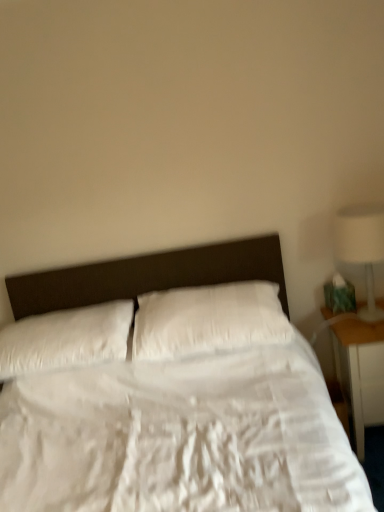
Where is `white soft pillow at left, which appears as the 1th pillow when viewed from the left`? white soft pillow at left, which appears as the 1th pillow when viewed from the left is located at coordinates (66, 339).

Measure the distance between white soft pillow at left, placed as the 2th pillow when sorted from right to left, and camera.

The distance of white soft pillow at left, placed as the 2th pillow when sorted from right to left, from camera is 5.82 feet.

Describe the element at coordinates (208, 320) in the screenshot. I see `white soft pillow at center, marked as the first pillow in a right-to-left arrangement` at that location.

Locate an element on the screen. wooden nightstand at right is located at coordinates (360, 373).

Can you confirm if wooden nightstand at right is shorter than white glossy lamp at right?

No.

Considering the sizes of objects wooden nightstand at right and white glossy lamp at right in the image provided, who is bigger, wooden nightstand at right or white glossy lamp at right?

wooden nightstand at right.

Does point (374, 381) appear closer or farther from the camera than point (382, 233)?

Point (374, 381) is farther from the camera than point (382, 233).

From the image's perspective, is wooden nightstand at right beneath white glossy lamp at right?

Indeed, from the image's perspective, wooden nightstand at right is shown beneath white glossy lamp at right.

From the image's perspective, which object appears higher, white glossy lamp at right or wooden nightstand at right?

white glossy lamp at right appears higher in the image.

Between white glossy lamp at right and wooden nightstand at right, which one has less height?

white glossy lamp at right.

Considering the relative positions of white glossy lamp at right and wooden nightstand at right in the image provided, is white glossy lamp at right to the left or to the right of wooden nightstand at right?

Clearly, white glossy lamp at right is on the left of wooden nightstand at right in the image.

Are white glossy lamp at right and white soft pillow at center, arranged as the second pillow when viewed from the left, located far from each other?

No.

Which object is thinner, white glossy lamp at right or white soft pillow at center, marked as the first pillow in a right-to-left arrangement?

white glossy lamp at right.

Who is bigger, white glossy lamp at right or white soft pillow at center, marked as the first pillow in a right-to-left arrangement?

With larger size is white soft pillow at center, marked as the first pillow in a right-to-left arrangement.

Is white soft pillow at left, which appears as the 1th pillow when viewed from the left, directly adjacent to wooden nightstand at right?

They are not placed beside each other.

From the image's perspective, which object appears higher, white soft pillow at left, which appears as the 1th pillow when viewed from the left, or wooden nightstand at right?

white soft pillow at left, which appears as the 1th pillow when viewed from the left, from the image's perspective.

From a real-world perspective, which is physically below, white soft pillow at left, placed as the 2th pillow when sorted from right to left, or wooden nightstand at right?

wooden nightstand at right, from a real-world perspective.

Looking at this image, between white soft pillow at left, which appears as the 1th pillow when viewed from the left, and wooden nightstand at right, which one has more height?

wooden nightstand at right is taller.

Does white soft pillow at left, which appears as the 1th pillow when viewed from the left, have a lesser width compared to white soft pillow at center, marked as the first pillow in a right-to-left arrangement?

No, white soft pillow at left, which appears as the 1th pillow when viewed from the left, is not thinner than white soft pillow at center, marked as the first pillow in a right-to-left arrangement.

Is point (76, 348) farther from camera compared to point (274, 300)?

No.

Between white soft pillow at center, arranged as the second pillow when viewed from the left, and white soft pillow at left, placed as the 2th pillow when sorted from right to left, which one has smaller width?

white soft pillow at center, arranged as the second pillow when viewed from the left, is thinner.

Which is nearer, (205, 307) or (113, 339)?

Point (205, 307) appears to be farther away from the viewer than point (113, 339).

Is white soft pillow at center, marked as the first pillow in a right-to-left arrangement, further to camera compared to white soft pillow at left, which appears as the 1th pillow when viewed from the left?

No, it is in front of white soft pillow at left, which appears as the 1th pillow when viewed from the left.

From a real-world perspective, which object rests below the other?

white soft pillow at left, placed as the 2th pillow when sorted from right to left, is physically lower.

Considering the relative sizes of white glossy lamp at right and white soft pillow at left, which appears as the 1th pillow when viewed from the left, in the image provided, is white glossy lamp at right taller than white soft pillow at left, which appears as the 1th pillow when viewed from the left,?

Correct, white glossy lamp at right is much taller as white soft pillow at left, which appears as the 1th pillow when viewed from the left.

Which object is further away from the camera, white glossy lamp at right or white soft pillow at left, placed as the 2th pillow when sorted from right to left?

white soft pillow at left, placed as the 2th pillow when sorted from right to left.

Where is `lamp above the white soft pillow at left, which appears as the 1th pillow when viewed from the left (from a real-world perspective)`? lamp above the white soft pillow at left, which appears as the 1th pillow when viewed from the left (from a real-world perspective) is located at coordinates (361, 247).

Considering the relative positions of white glossy lamp at right and white soft pillow at left, which appears as the 1th pillow when viewed from the left, in the image provided, is white glossy lamp at right to the left of white soft pillow at left, which appears as the 1th pillow when viewed from the left, from the viewer's perspective?

Incorrect, white glossy lamp at right is not on the left side of white soft pillow at left, which appears as the 1th pillow when viewed from the left.

Locate an element on the screen. lamp above the wooden nightstand at right (from a real-world perspective) is located at coordinates (361, 247).

At what (x,y) coordinates should I click in order to perform the action: click on nightstand located behind the white glossy lamp at right. Please return your answer as a coordinate pair (x, y). Looking at the image, I should click on (360, 373).

When comparing their distances from white soft pillow at center, marked as the first pillow in a right-to-left arrangement, does white glossy lamp at right or wooden nightstand at right seem closer?

wooden nightstand at right is positioned closer to the anchor white soft pillow at center, marked as the first pillow in a right-to-left arrangement.

Looking at the image, which one is located closer to white soft pillow at center, arranged as the second pillow when viewed from the left, wooden nightstand at right or white soft pillow at left, placed as the 2th pillow when sorted from right to left?

The object closer to white soft pillow at center, arranged as the second pillow when viewed from the left, is white soft pillow at left, placed as the 2th pillow when sorted from right to left.

When comparing their distances from white soft pillow at left, placed as the 2th pillow when sorted from right to left, does white soft pillow at center, arranged as the second pillow when viewed from the left, or wooden nightstand at right seem further?

Among the two, wooden nightstand at right is located further to white soft pillow at left, placed as the 2th pillow when sorted from right to left.

Considering their positions, is white soft pillow at left, placed as the 2th pillow when sorted from right to left, positioned closer to white soft pillow at center, marked as the first pillow in a right-to-left arrangement, than wooden nightstand at right?

The object closer to white soft pillow at center, marked as the first pillow in a right-to-left arrangement, is white soft pillow at left, placed as the 2th pillow when sorted from right to left.

Which object lies further to the anchor point white soft pillow at left, placed as the 2th pillow when sorted from right to left, white glossy lamp at right or wooden nightstand at right?

Based on the image, white glossy lamp at right appears to be further to white soft pillow at left, placed as the 2th pillow when sorted from right to left.

Based on their spatial positions, is white glossy lamp at right or white soft pillow at left, placed as the 2th pillow when sorted from right to left, further from wooden nightstand at right?

Among the two, white soft pillow at left, placed as the 2th pillow when sorted from right to left, is located further to wooden nightstand at right.

Based on their spatial positions, is white soft pillow at center, marked as the first pillow in a right-to-left arrangement, or white soft pillow at left, which appears as the 1th pillow when viewed from the left, closer to white glossy lamp at right?

Based on the image, white soft pillow at center, marked as the first pillow in a right-to-left arrangement, appears to be nearer to white glossy lamp at right.

Looking at the image, which one is located further to wooden nightstand at right, white soft pillow at left, which appears as the 1th pillow when viewed from the left, or white soft pillow at center, marked as the first pillow in a right-to-left arrangement?

white soft pillow at left, which appears as the 1th pillow when viewed from the left, lies further to wooden nightstand at right than the other object.

Find the location of a particular element. lamp between white soft pillow at center, arranged as the second pillow when viewed from the left, and wooden nightstand at right from left to right is located at coordinates (361, 247).

Find the location of a particular element. pillow located between white soft pillow at left, which appears as the 1th pillow when viewed from the left, and wooden nightstand at right in the left-right direction is located at coordinates (208, 320).

This screenshot has height=512, width=384. I want to click on pillow between white soft pillow at left, which appears as the 1th pillow when viewed from the left, and white glossy lamp at right from left to right, so click(x=208, y=320).

Where is `lamp between white soft pillow at left, placed as the 2th pillow when sorted from right to left, and wooden nightstand at right from left to right`? The image size is (384, 512). lamp between white soft pillow at left, placed as the 2th pillow when sorted from right to left, and wooden nightstand at right from left to right is located at coordinates (361, 247).